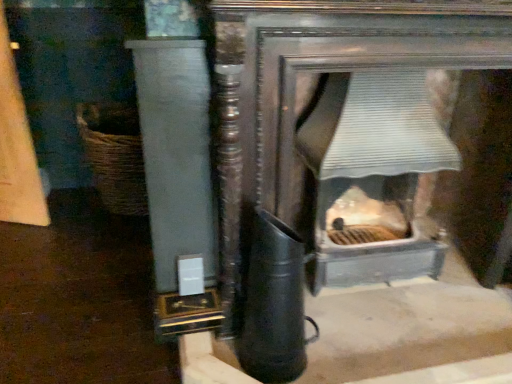
This screenshot has height=384, width=512. Describe the element at coordinates (373, 176) in the screenshot. I see `metallic gray fireplace at center` at that location.

Identify the location of white glossy pillar at left. The width and height of the screenshot is (512, 384). (176, 154).

From a real-world perspective, is metallic gray fireplace at center over woven brown basket at left?

Yes, from a real-world perspective, metallic gray fireplace at center is over woven brown basket at left

Is metallic gray fireplace at center far from woven brown basket at left?

metallic gray fireplace at center is positioned a significant distance from woven brown basket at left.

Can you confirm if metallic gray fireplace at center is wider than woven brown basket at left?

No.

Based on the photo, is metallic gray fireplace at center oriented towards white glossy pillar at left?

No, metallic gray fireplace at center is not turned towards white glossy pillar at left.

From a real-world perspective, is metallic gray fireplace at center beneath white glossy pillar at left?

Yes, from a real-world perspective, metallic gray fireplace at center is under white glossy pillar at left.

In the image, is metallic gray fireplace at center positioned in front of or behind white glossy pillar at left?

In the image, metallic gray fireplace at center appears behind white glossy pillar at left.

Locate an element on the screen. The image size is (512, 384). fireplace above the white glossy pillar at left (from the image's perspective) is located at coordinates (373, 176).

How different are the orientations of woven brown basket at left and metallic gray fireplace at center in degrees?

The angular difference between woven brown basket at left and metallic gray fireplace at center is 2.01 degrees.

Between woven brown basket at left and metallic gray fireplace at center, which one has smaller width?

metallic gray fireplace at center is thinner.

Image resolution: width=512 pixels, height=384 pixels. Find the location of `basket behind the metallic gray fireplace at center`. basket behind the metallic gray fireplace at center is located at coordinates (114, 155).

Considering their positions, is woven brown basket at left located in front of or behind metallic gray fireplace at center?

Visually, woven brown basket at left is located behind metallic gray fireplace at center.

I want to click on pillar on the right of the woven brown basket at left, so click(176, 154).

Which is correct: white glossy pillar at left is inside woven brown basket at left, or outside of it?

white glossy pillar at left is not enclosed by woven brown basket at left.

In the scene shown: Considering the relative sizes of white glossy pillar at left and woven brown basket at left in the image provided, is white glossy pillar at left thinner than woven brown basket at left?

Indeed, white glossy pillar at left has a lesser width compared to woven brown basket at left.

Does white glossy pillar at left turn towards woven brown basket at left?

No, white glossy pillar at left is not facing towards woven brown basket at left.

Is woven brown basket at left touching white glossy pillar at left?

No, woven brown basket at left is not next to white glossy pillar at left.

From their relative heights in the image, would you say woven brown basket at left is taller or shorter than white glossy pillar at left?

woven brown basket at left is shorter than white glossy pillar at left.

From the picture: Can you confirm if woven brown basket at left is wider than white glossy pillar at left?

Yes, woven brown basket at left is wider than white glossy pillar at left.

Would you say white glossy pillar at left is inside or outside metallic gray fireplace at center?

white glossy pillar at left lies outside metallic gray fireplace at center.

You are a GUI agent. You are given a task and a screenshot of the screen. Output one action in this format:
    pyautogui.click(x=<x>, y=<y>)
    Task: Click on the fireplace behind the white glossy pillar at left
    
    Given the screenshot: What is the action you would take?
    pyautogui.click(x=373, y=176)

You are a GUI agent. You are given a task and a screenshot of the screen. Output one action in this format:
    pyautogui.click(x=<x>, y=<y>)
    Task: Click on the basket that appears behind the metallic gray fireplace at center
    This screenshot has width=512, height=384.
    Given the screenshot: What is the action you would take?
    pyautogui.click(x=114, y=155)

Where is `pillar in front of the metallic gray fireplace at center`? Image resolution: width=512 pixels, height=384 pixels. pillar in front of the metallic gray fireplace at center is located at coordinates (176, 154).

Considering their positions, is woven brown basket at left positioned further to metallic gray fireplace at center than white glossy pillar at left?

The object further to metallic gray fireplace at center is woven brown basket at left.

Estimate the real-world distances between objects in this image. Which object is closer to woven brown basket at left, white glossy pillar at left or metallic gray fireplace at center?

Among the two, white glossy pillar at left is located nearer to woven brown basket at left.

When comparing their distances from metallic gray fireplace at center, does white glossy pillar at left or woven brown basket at left seem closer?

white glossy pillar at left is positioned closer to the anchor metallic gray fireplace at center.

Looking at the image, which one is located further to white glossy pillar at left, woven brown basket at left or metallic gray fireplace at center?

Based on the image, woven brown basket at left appears to be further to white glossy pillar at left.

Looking at the image, which one is located closer to white glossy pillar at left, metallic gray fireplace at center or woven brown basket at left?

Based on the image, metallic gray fireplace at center appears to be nearer to white glossy pillar at left.

From the picture: When comparing their distances from woven brown basket at left, does metallic gray fireplace at center or white glossy pillar at left seem further?

Based on the image, metallic gray fireplace at center appears to be further to woven brown basket at left.

Find the location of a particular element. pillar between woven brown basket at left and metallic gray fireplace at center is located at coordinates (176, 154).